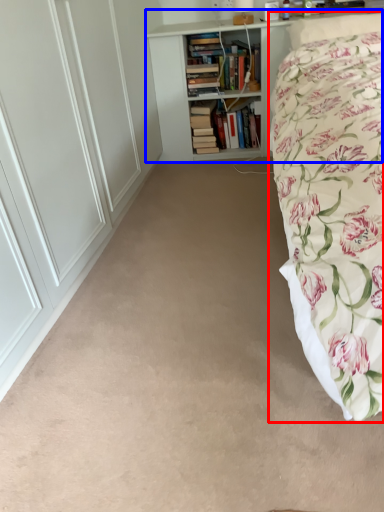
Question: Among these objects, which one is farthest to the camera, bed (highlighted by a red box) or bookcase (highlighted by a blue box)?

Choices:
 (A) bed
 (B) bookcase

Answer: (B)